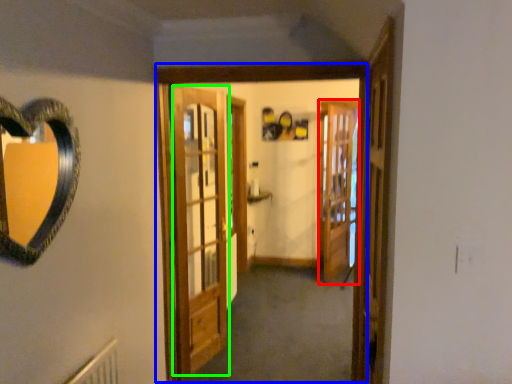
Question: Estimate the real-world distances between objects in this image. Which object is farther from screen door (highlighted by a red box), window frame (highlighted by a blue box) or barn door (highlighted by a green box)?

Choices:
 (A) window frame
 (B) barn door

Answer: (A)